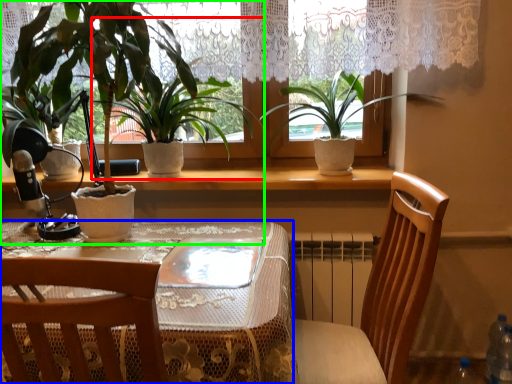
Question: Based on their relative distances, which object is farther from houseplant (highlighted by a red box)? Choose from table (highlighted by a blue box) and houseplant (highlighted by a green box).

Choices:
 (A) table
 (B) houseplant

Answer: (A)